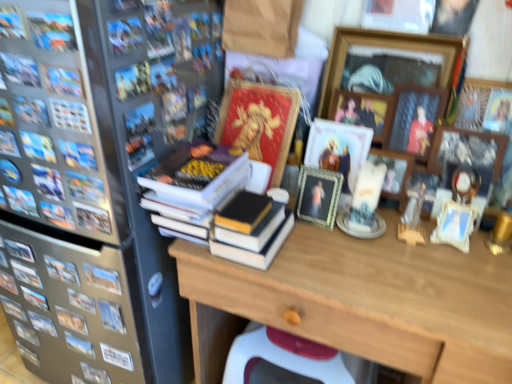
Find the location of `unoccupied region to the right of green textured frame at center, placed as the first picture frame when sorted from left to right`. unoccupied region to the right of green textured frame at center, placed as the first picture frame when sorted from left to right is located at coordinates (396, 246).